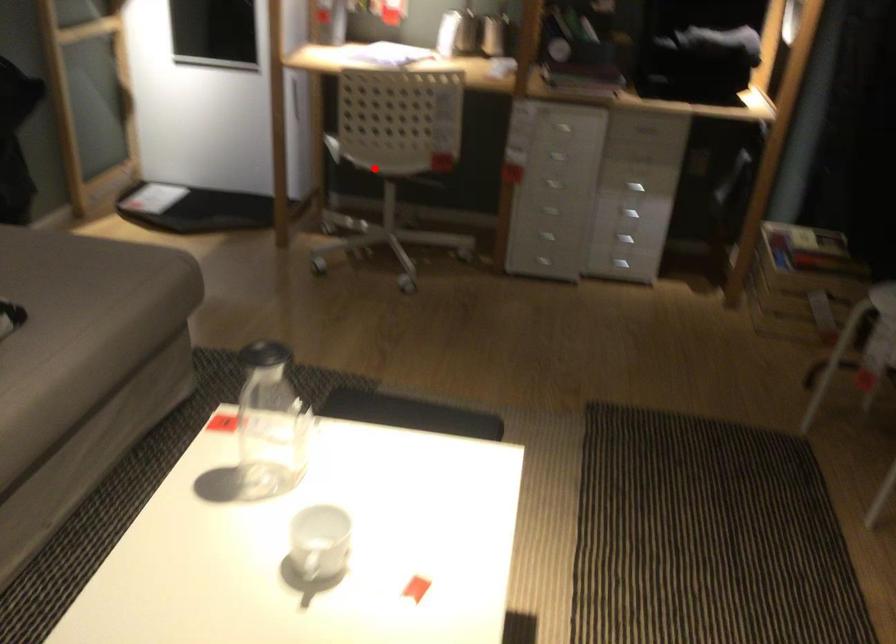
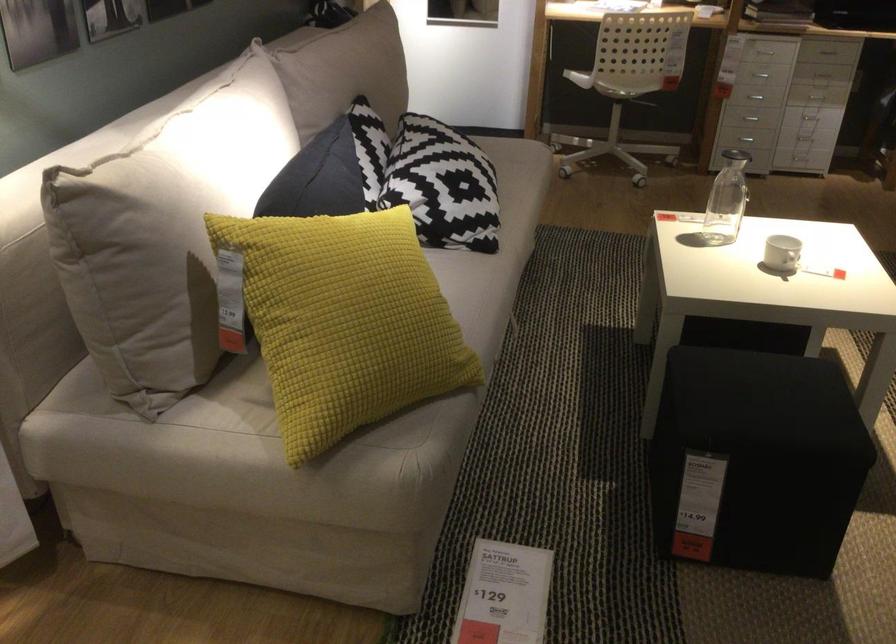
Where in the second image is the point corresponding to the highlighted location from the first image?

(627, 80)